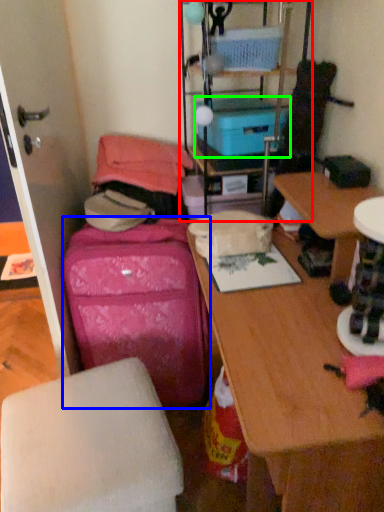
Question: Which object is the farthest from shelf (highlighted by a red box)? Choose among these: luggage (highlighted by a blue box) or storage box (highlighted by a green box).

Choices:
 (A) luggage
 (B) storage box

Answer: (A)